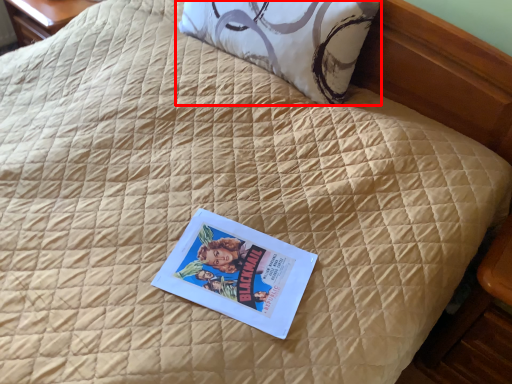
Question: From the image, what is the correct spatial relationship of pillow (annotated by the red box) in relation to paperback book?

Choices:
 (A) right
 (B) left

Answer: (A)